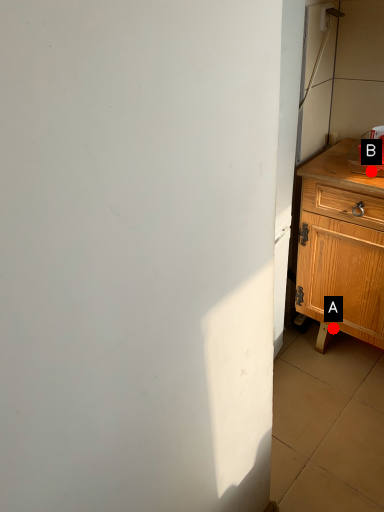
Question: Two points are circled on the image, labeled by A and B beside each circle. Which point is further to the camera?

Choices:
 (A) A is further
 (B) B is further

Answer: (A)